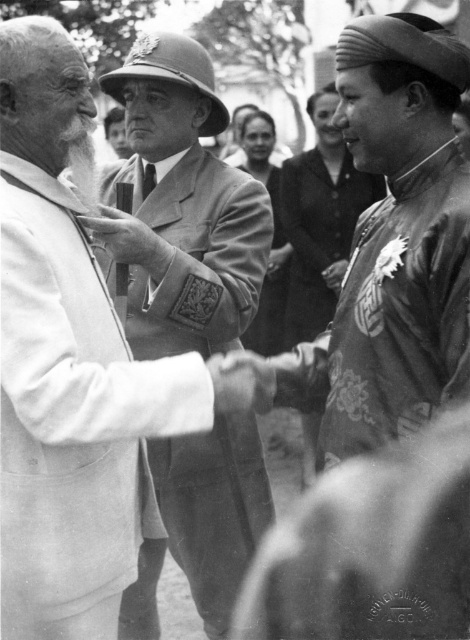
You are a photographer standing 1.8 meters away from the matte gold medallion at center. Can you reach it to adjust its position without moving closer?

The matte gold medallion at center is 3.69 meters from viewer. Since you are 1.8 meters away, you are still 1.89 meters away from the medallion, so you cannot reach it without moving closer.

Based on the scene described, which object occupies more space in the image between the smooth fabric uniform at center and the matte gold medallion at center?

The smooth fabric uniform at center is bigger than the matte gold medallion at center, so it occupies more space in the image.